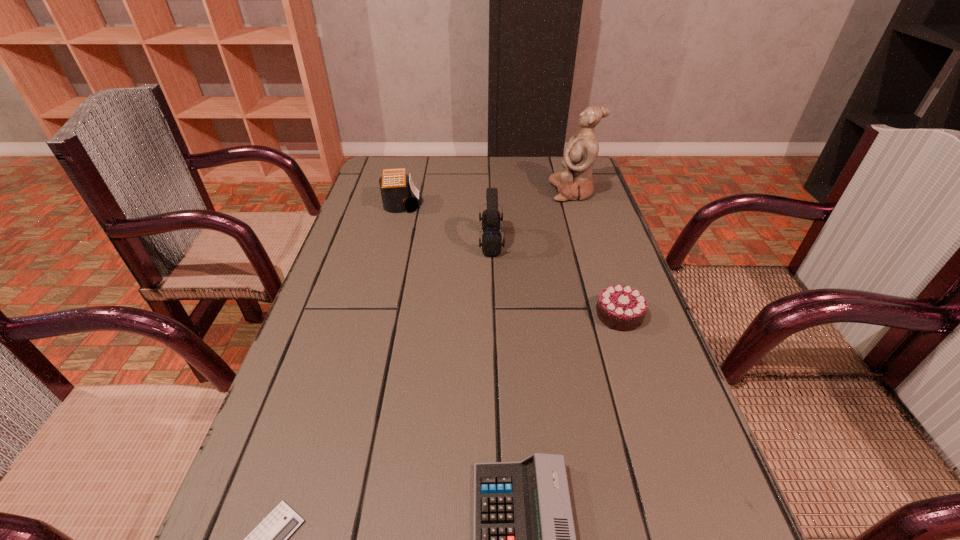
Image resolution: width=960 pixels, height=540 pixels. I want to click on figurine, so click(x=575, y=182).

Find the location of a particular element. the fifth shortest object is located at coordinates click(491, 244).

This screenshot has height=540, width=960. I want to click on the fourth nearest object, so click(491, 244).

What are the coordinates of `the farthest calculator` in the screenshot? It's located at (395, 185).

The height and width of the screenshot is (540, 960). Find the location of `the third tallest object`. the third tallest object is located at coordinates (395, 185).

Find the location of a particular element. Image resolution: width=960 pixels, height=540 pixels. the third shortest object is located at coordinates (622, 308).

The height and width of the screenshot is (540, 960). Identify the location of the third nearest object. coord(622,308).

Locate an element on the screen. This screenshot has width=960, height=540. free space located 0.320m on the front-facing side of the tallest object is located at coordinates (445, 191).

At what (x,y) coordinates should I click in order to perform the action: click on vacant space located on the front-facing side of the tallest object. Please return your answer as a coordinate pair (x, y). Looking at the image, I should click on (422, 191).

The width and height of the screenshot is (960, 540). I want to click on free location located 0.260m on the front-facing side of the tallest object, so click(465, 191).